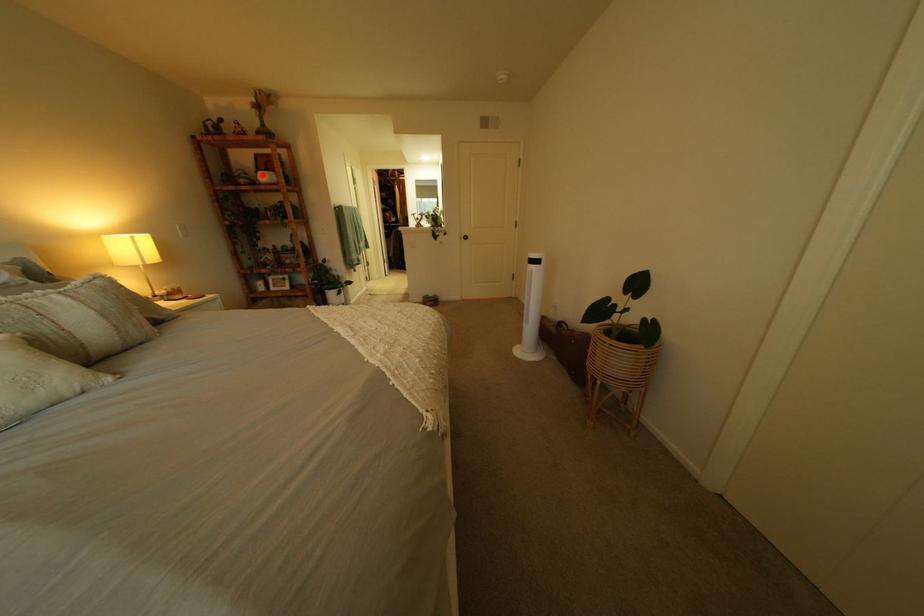
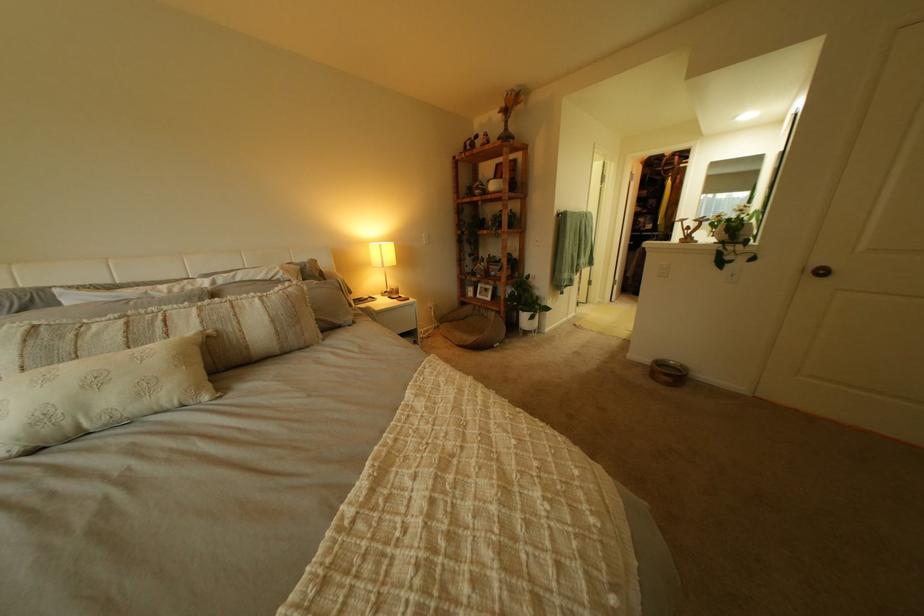
Where in the second image is the point corresponding to the highlighted location from the first image?

(497, 185)